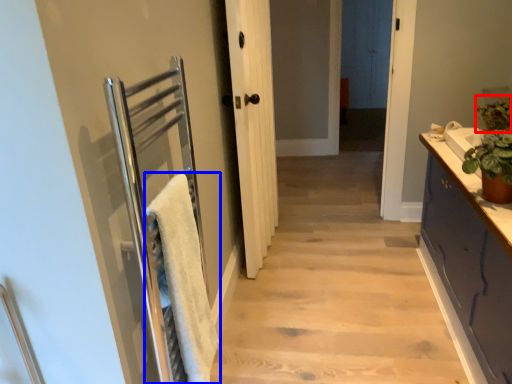
Question: Which object appears closest to the camera in this image, plant (highlighted by a red box) or bath towel (highlighted by a blue box)?

Choices:
 (A) plant
 (B) bath towel

Answer: (B)